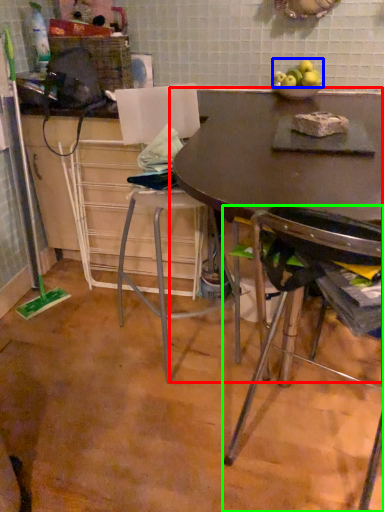
Question: Considering the real-world distances, which object is closest to table (highlighted by a red box)? apple (highlighted by a blue box) or chair (highlighted by a green box).

Choices:
 (A) apple
 (B) chair

Answer: (A)